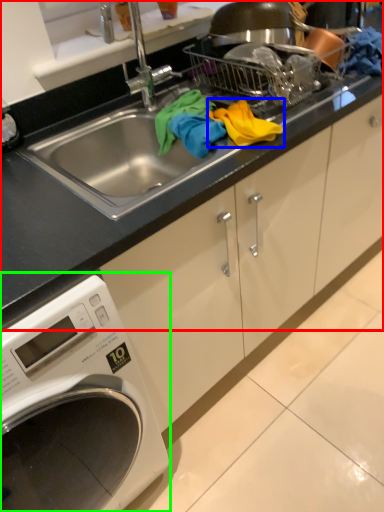
Question: Based on their relative distances, which object is nearer to countertop (highlighted by a red box)? Choose from material (highlighted by a blue box) and washing machine (highlighted by a green box).

Choices:
 (A) material
 (B) washing machine

Answer: (A)